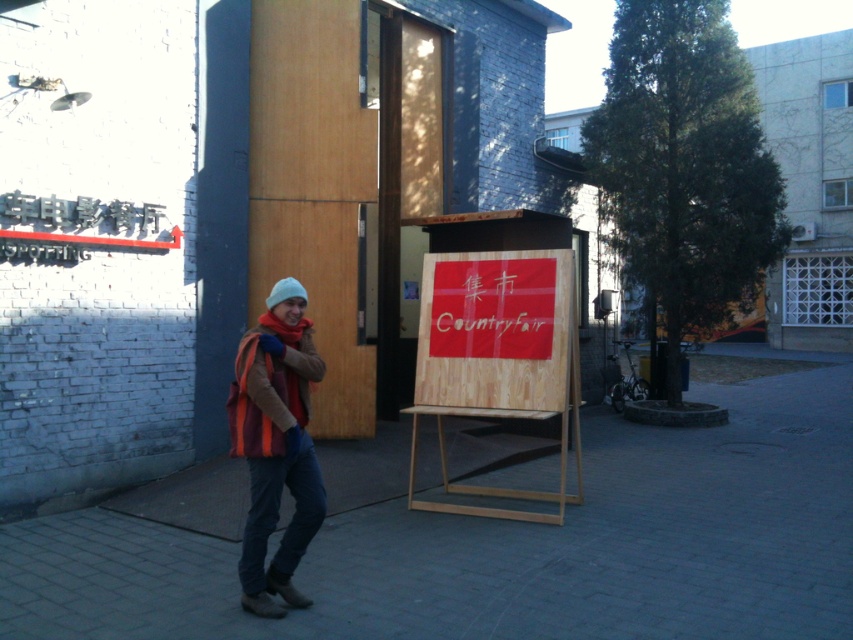
Between brick pavement at center and brown suede jacket at center, which one appears on the left side from the viewer's perspective?

From the viewer's perspective, brown suede jacket at center appears more on the left side.

Is point (68, 556) in front of point (277, 323)?

No, (68, 556) is further to viewer.

Does point (637, 515) lie in front of point (260, 394)?

No, it is behind (260, 394).

Find the location of a particular element. brick pavement at center is located at coordinates (514, 547).

Can you confirm if knitted woolen hat at center is positioned above white knit hat at center?

Actually, knitted woolen hat at center is below white knit hat at center.

Is knitted woolen hat at center smaller than white knit hat at center?

No.

Find the location of `knitted woolen hat at center`. knitted woolen hat at center is located at coordinates (276, 451).

Which is in front, point (329, 589) or point (525, 348)?

Point (329, 589)

Which of these two, brick pavement at center or wooden sign at center, stands taller?

Standing taller between the two is wooden sign at center.

Where is `brick pavement at center`? brick pavement at center is located at coordinates (514, 547).

Where is `brick pavement at center`? brick pavement at center is located at coordinates (514, 547).